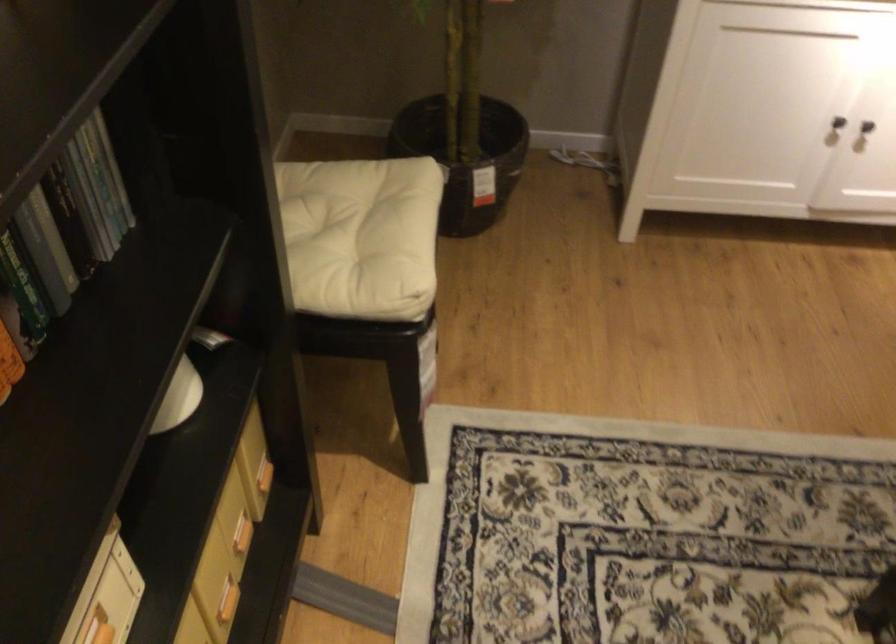
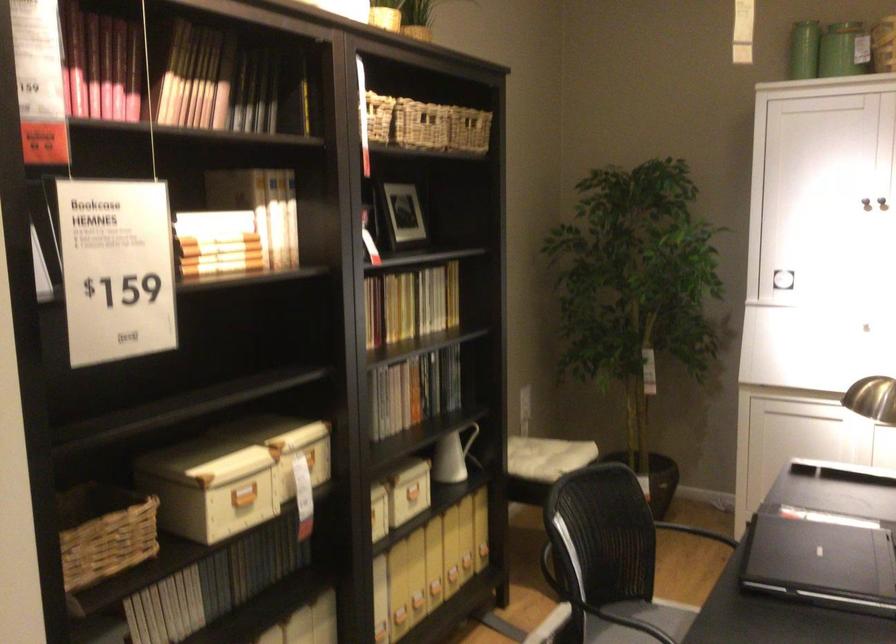
In the second image, find the point that corresponds to point (123, 573) in the first image.

(418, 491)